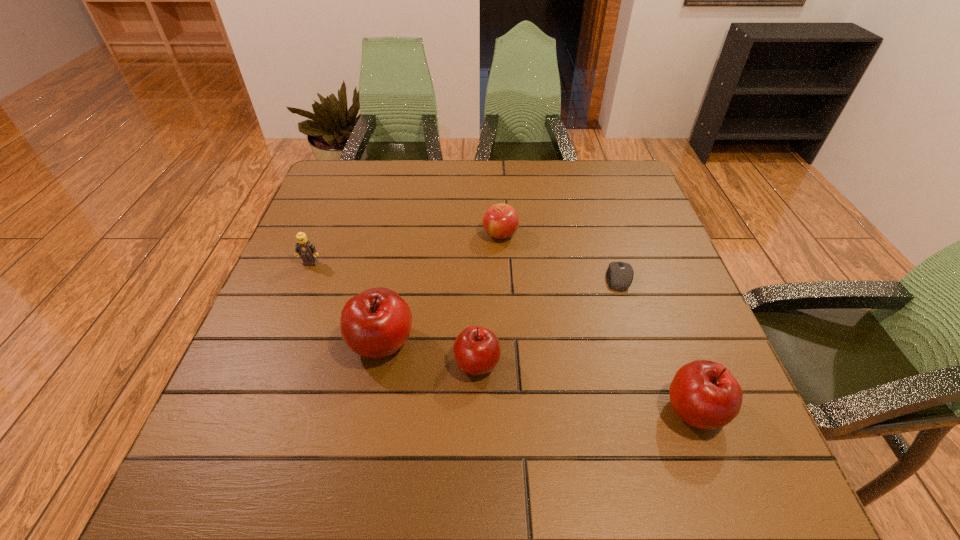
At what (x,y) coordinates should I click in order to perform the action: click on free region at the far edge of the desktop. Please return your answer as a coordinate pair (x, y). Image resolution: width=960 pixels, height=540 pixels. Looking at the image, I should click on (469, 162).

Locate an element on the screen. free space at the near edge of the desktop is located at coordinates (517, 416).

I want to click on vacant area at the left edge, so click(344, 275).

What are the coordinates of `vacant point at the right edge` in the screenshot? It's located at (653, 330).

The height and width of the screenshot is (540, 960). I want to click on free location at the far left corner of the desktop, so click(x=372, y=176).

Locate an element on the screen. vacant region at the far right corner of the desktop is located at coordinates (621, 172).

Find the location of a particular element. The image size is (960, 540). vacant space at the near right corner of the desktop is located at coordinates (667, 398).

At what (x,y) coordinates should I click in order to perform the action: click on empty space that is in between the fifth shortest object and the farthest apple. Please return your answer as a coordinate pair (x, y). The width and height of the screenshot is (960, 540). Looking at the image, I should click on (597, 322).

The image size is (960, 540). What are the coordinates of `blank region between the fifth object from right to left and the second tallest apple` in the screenshot? It's located at (538, 376).

Image resolution: width=960 pixels, height=540 pixels. In order to click on vacant area that lies between the tallest apple and the third shortest apple in this screenshot , I will do `click(538, 376)`.